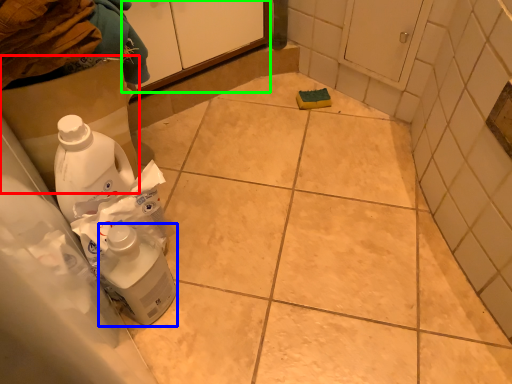
Question: Which is nearer to the cardboard box (highlighted by a red box)? cleaning product (highlighted by a blue box) or cabinetry (highlighted by a green box).

Choices:
 (A) cleaning product
 (B) cabinetry

Answer: (A)